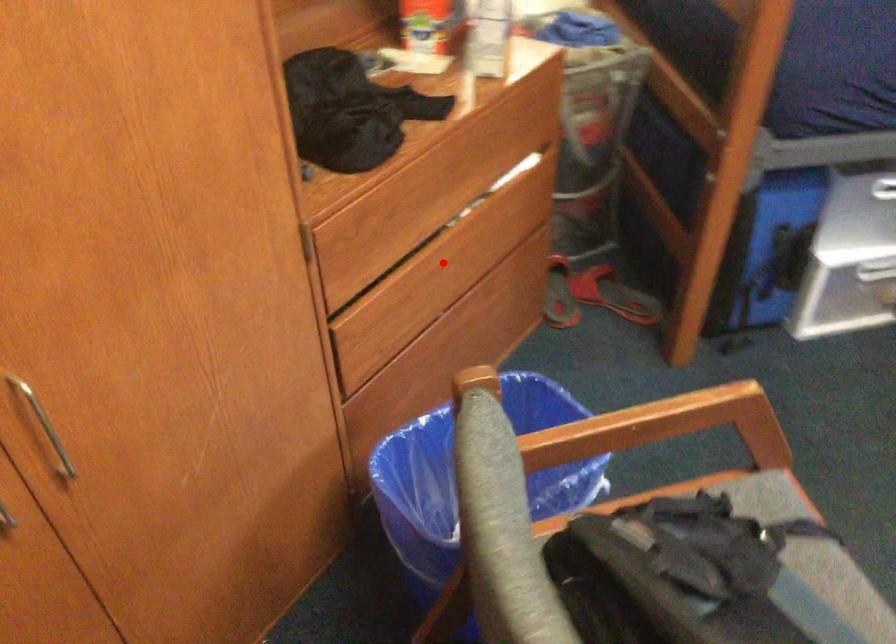
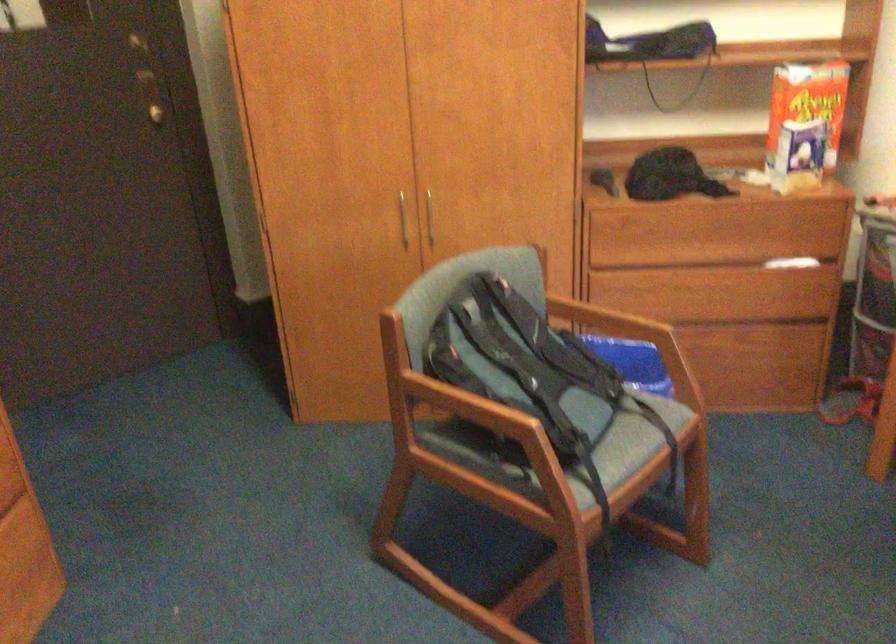
The point at the highlighted location is marked in the first image. Where is the corresponding point in the second image?

(700, 290)